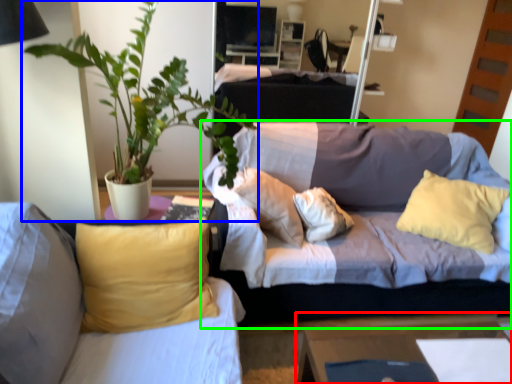
Question: Considering the real-world distances, which object is closest to table (highlighted by a red box)? houseplant (highlighted by a blue box) or studio couch (highlighted by a green box).

Choices:
 (A) houseplant
 (B) studio couch

Answer: (B)